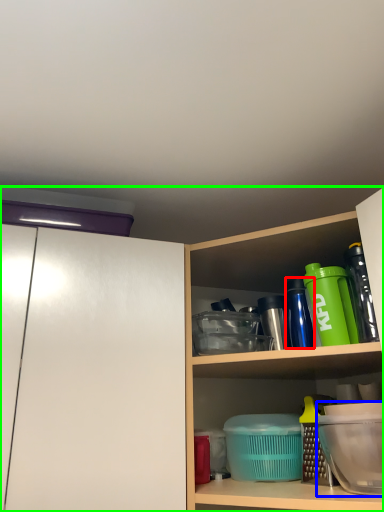
Question: Which object is the closest to the bottle (highlighted by a red box)? Choose among these: appliance (highlighted by a blue box) or cabinetry (highlighted by a green box).

Choices:
 (A) appliance
 (B) cabinetry

Answer: (A)